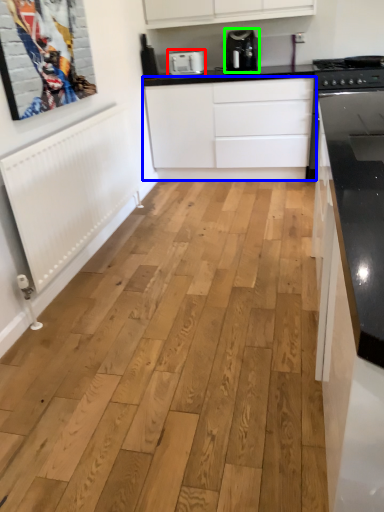
Question: Estimate the real-world distances between objects in this image. Which object is closer to kitchen appliance (highlighted by a red box), cabinetry (highlighted by a blue box) or home appliance (highlighted by a green box)?

Choices:
 (A) cabinetry
 (B) home appliance

Answer: (B)